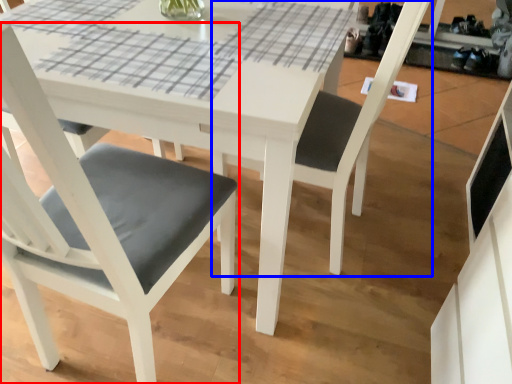
Question: Which of the following is the closest to the observer, chair (highlighted by a red box) or chair (highlighted by a blue box)?

Choices:
 (A) chair
 (B) chair

Answer: (A)